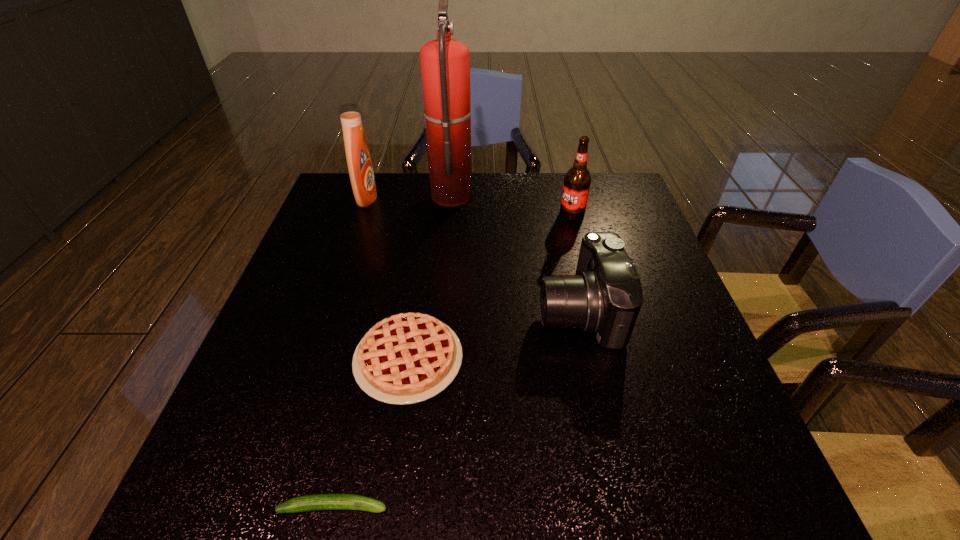
The image size is (960, 540). Identify the location of free location that satisfies the following two spatial constraints: 1. with the nozzle and gauge on the fourth shortest object; 2. on the left side of the tallest object. [450, 214].

Locate an element on the screen. The width and height of the screenshot is (960, 540). free point that satisfies the following two spatial constraints: 1. on the front-facing side of the pie; 2. on the left side of the fifth shortest object is located at coordinates (312, 360).